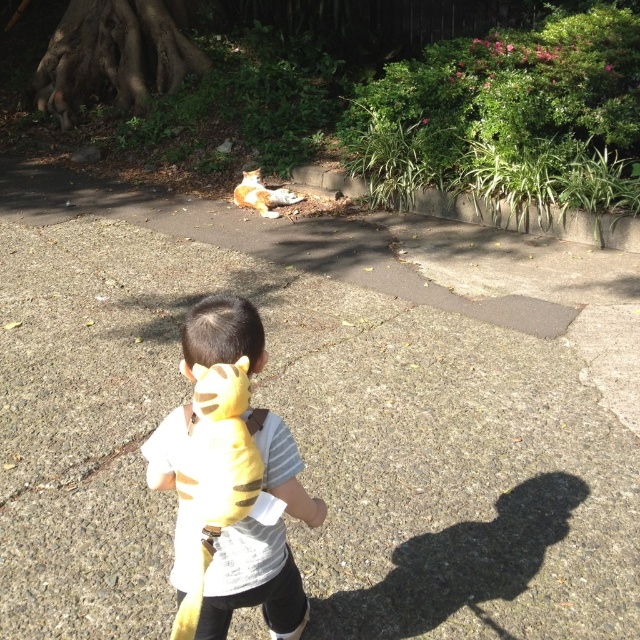
Question: Estimate the real-world distances between objects in this image. Which object is farther from the orange fur cat at center?

Choices:
 (A) yellow plush toy at center
 (B) yellow plush toy at back

Answer: (B)

Question: Is yellow plush toy at center further to camera compared to orange fur cat at center?

Choices:
 (A) yes
 (B) no

Answer: (B)

Question: Can you confirm if yellow plush toy at center is smaller than orange fur cat at center?

Choices:
 (A) no
 (B) yes

Answer: (A)

Question: Is yellow plush toy at back smaller than orange fur cat at center?

Choices:
 (A) yes
 (B) no

Answer: (A)

Question: Which point appears closest to the camera in this image?

Choices:
 (A) pyautogui.click(x=237, y=195)
 (B) pyautogui.click(x=220, y=436)

Answer: (B)

Question: Which point appears farthest from the camera in this image?

Choices:
 (A) (198, 557)
 (B) (236, 188)

Answer: (B)